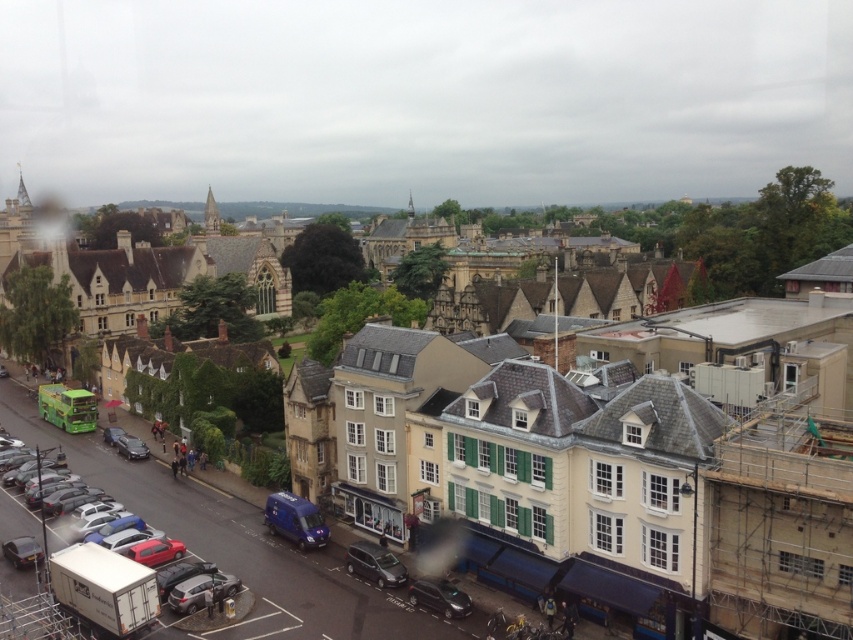
Question: Which of these objects is positioned closest to the blue matte van at lower center?

Choices:
 (A) matte black car at lower left
 (B) shiny silver car at lower left
 (C) shiny black car at lower center
 (D) matte black van at lower left

Answer: (D)

Question: Which of the following is the farthest from the observer?

Choices:
 (A) (297, 516)
 (B) (415, 586)
 (C) (119, 452)

Answer: (C)

Question: Is blue matte van at lower center below metallic silver car at lower center?

Choices:
 (A) yes
 (B) no

Answer: (B)

Question: Can you confirm if blue matte van at lower center is positioned to the right of shiny silver car at lower left?

Choices:
 (A) yes
 (B) no

Answer: (A)

Question: Based on their relative distances, which object is farther from the blue matte van at lower center?

Choices:
 (A) matte black car at lower left
 (B) matte stone buildings at center

Answer: (A)

Question: Where is matte stone buildings at center located in relation to matte black van at lower left in the image?

Choices:
 (A) above
 (B) below

Answer: (A)